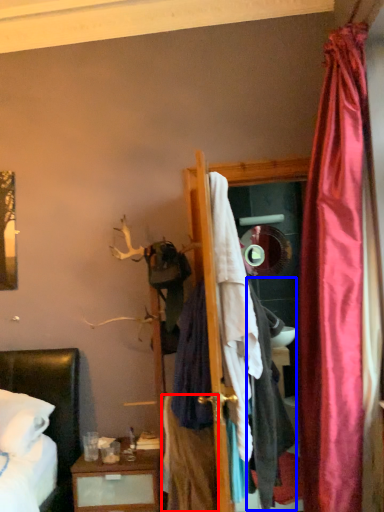
Question: Which point is closer to the camera, clothing (highlighted by a red box) or clothing (highlighted by a blue box)?

Choices:
 (A) clothing
 (B) clothing

Answer: (B)